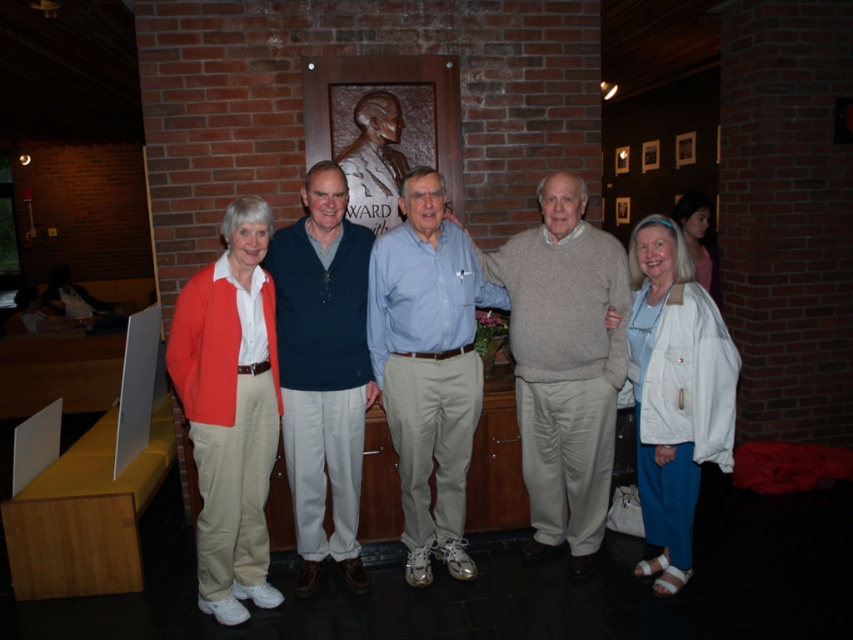
In the scene shown: You are standing in the room and want to greet the person wearing the matte orange cardigan at left. Which direction should you walk relative to the dark blue sweater at center?

The matte orange cardigan at left is to the left of the dark blue sweater at center, so you should walk to the left of the dark blue sweater at center to reach the matte orange cardigan at left.

In the scene shown: Based on the coordinates provided, which object is located at point (428, 365) in the image?

The point (428, 365) marks the location of the light blue shirt at center.

You are standing at the origin of the coordinate system in the image. Which point, point [234,616] or point [276,246], is closer to you?

Point [234,616] is closer to you because it is in front of point [276,246].